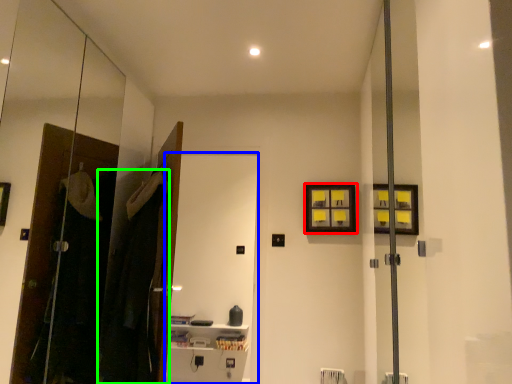
Question: Which is nearer to the picture frame (highlighted by a red box)? screen door (highlighted by a blue box) or laundry (highlighted by a green box).

Choices:
 (A) screen door
 (B) laundry

Answer: (B)